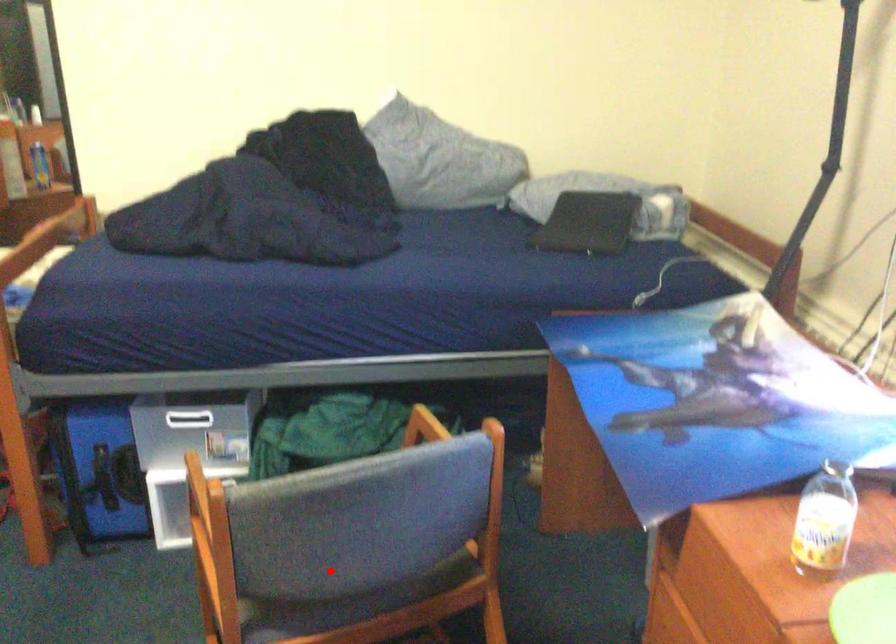
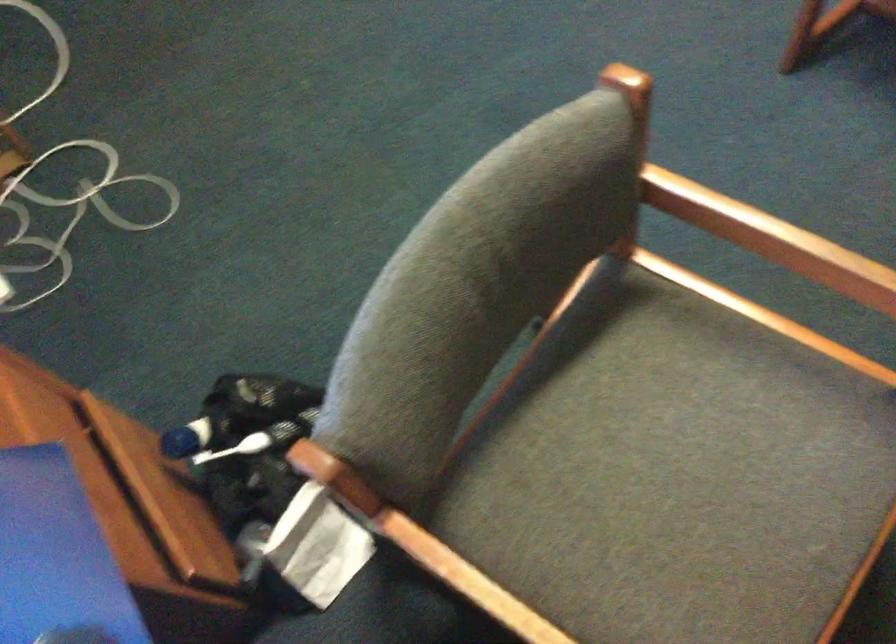
Question: I am providing you with two images of the same scene from different viewpoints. Given a red point in image1, look at the same physical point in image2. Is it:

Choices:
 (A) Closer to the viewpoint
 (B) Farther from the viewpoint

Answer: (A)